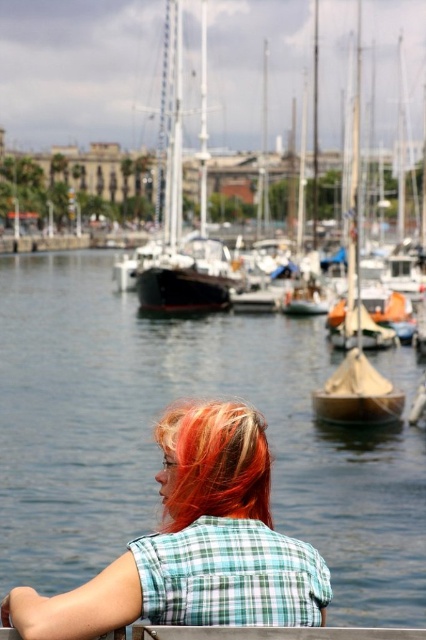
Question: Which of the following is the farthest from the observer?

Choices:
 (A) wooden sailboat at center
 (B) plaid fabric shirt at lower center
 (C) white canvas sailboat at right
 (D) shiny orange hair at lower center

Answer: (A)

Question: Can you confirm if wooden sailboat at center is positioned to the left of shiny orange hair at lower center?

Choices:
 (A) yes
 (B) no

Answer: (A)

Question: Is shiny orange hair at lower center smaller than white canvas sailboat at right?

Choices:
 (A) no
 (B) yes

Answer: (B)

Question: Can you confirm if plaid fabric shirt at lower center is smaller than shiny orange hair at lower center?

Choices:
 (A) yes
 (B) no

Answer: (B)

Question: Which point is farther from the camera taking this photo?

Choices:
 (A) (265, 515)
 (B) (374, 404)
 (C) (383, 608)

Answer: (B)

Question: Which object is the closest to the white canvas sailboat at right?

Choices:
 (A) clear blue water at center
 (B) plaid fabric shirt at lower center
 (C) shiny orange hair at lower center

Answer: (A)